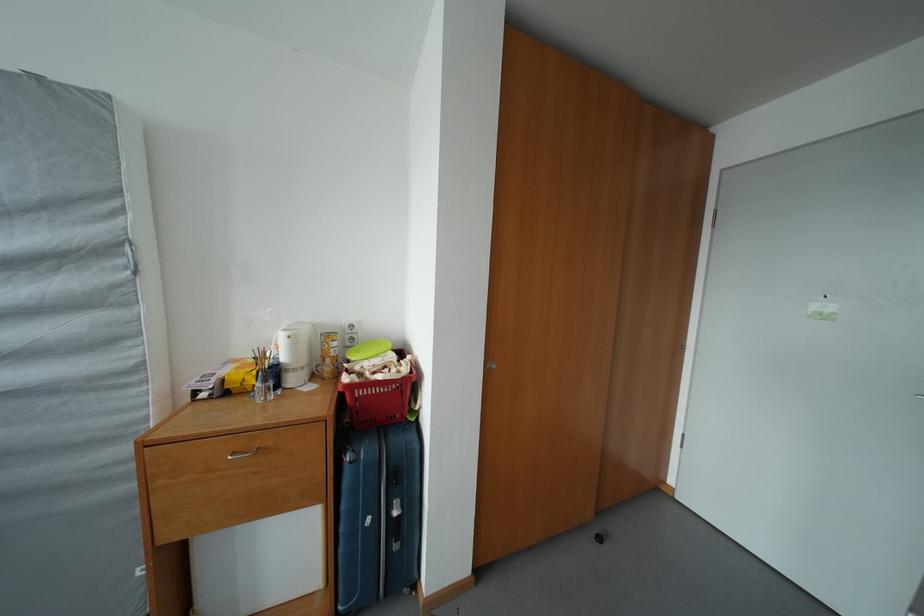
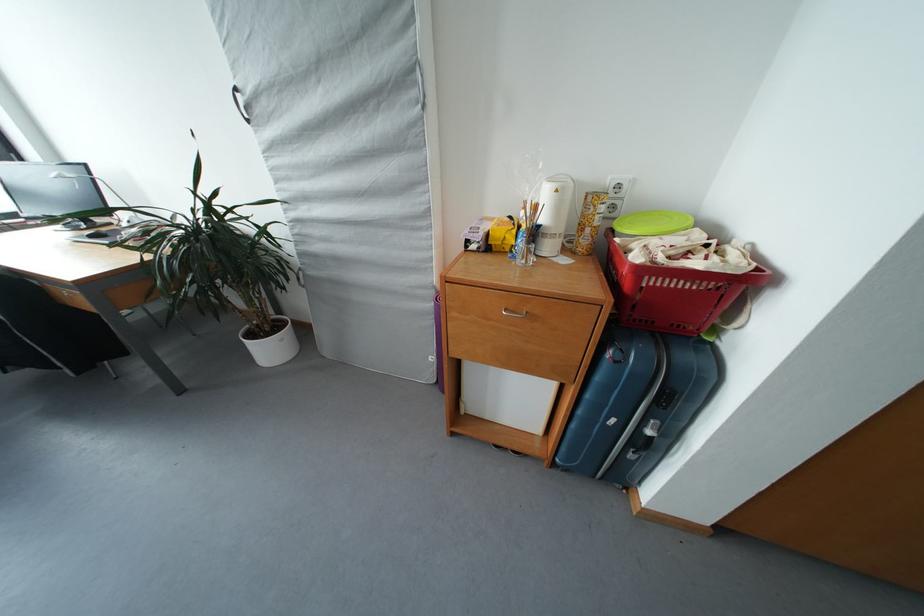
The point at (402, 517) is marked in the first image. Where is the corresponding point in the second image?

(655, 437)